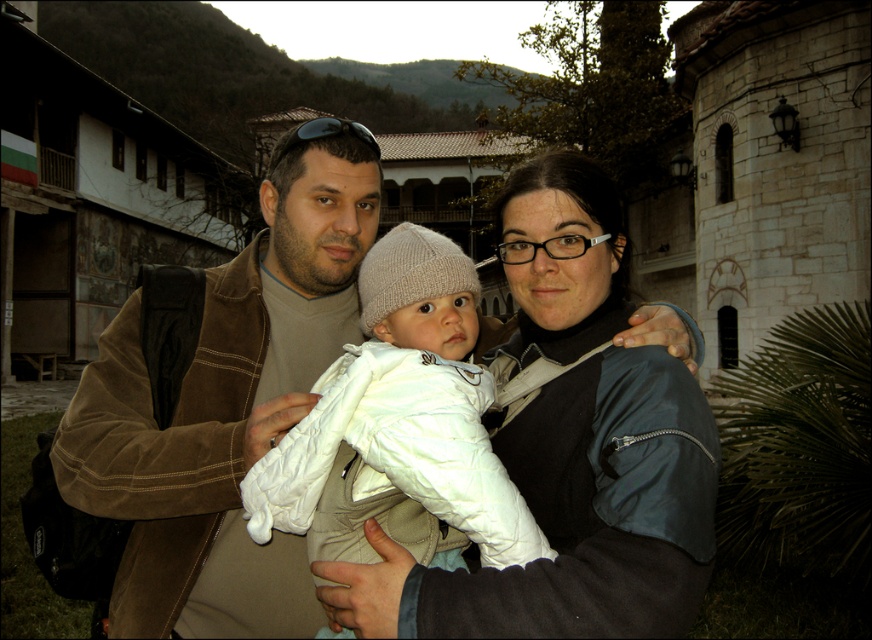
From the picture: You are standing at the point marked by coordinates point (218,416). What object is located exactly at this point in the image?

The point (218,416) marks the location of the brown suede jacket at center.

You are a photographer trying to capture a photo of the family. The camera you are using has a focus range that can only accommodate objects up to 1.5 meters in height. Given that the brown suede jacket at center and the white soft fabric baby at center are both in the frame, will the camera be able to focus on both subjects simultaneously?

The brown suede jacket at center is taller than the white soft fabric baby at center. Since the camera can focus on objects up to 1.5 meters, and the jacket is the taller one, as long as the jacket is within the 1.5 meter height limit, both subjects will be in focus. However, if the jacket exceeds 1.5 meters, neither will be properly focused. The answer depends on the actual height of the jacket.

You are a photographer trying to capture a group photo of the family. The camera you are using has a focus area that can only accommodate objects up to 1 meter wide. Given the brown suede jacket at center and the white soft fabric baby at center, will both fit within the focus area if they are positioned side by side?

The brown suede jacket at center might be wider than the white soft fabric baby at center. If the total width of both objects together does not exceed 1 meter, they could fit within the focus area. However, since the jacket might be wider, it depends on their combined width. Without exact measurements, it is uncertain if they will both fit.